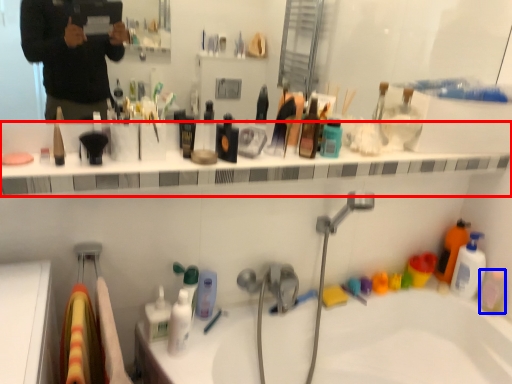
Question: Which point is closer to the camera, ledge (highlighted by a red box) or mouthwash (highlighted by a blue box)?

Choices:
 (A) ledge
 (B) mouthwash

Answer: (A)